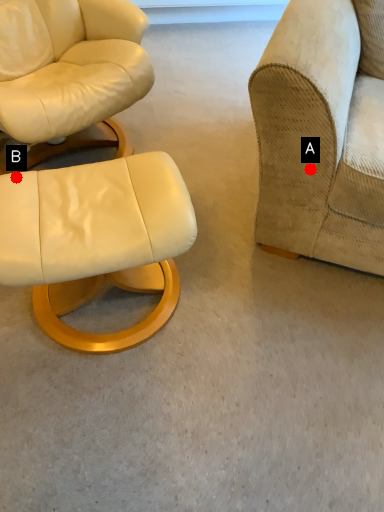
Question: Two points are circled on the image, labeled by A and B beside each circle. Which of the following is the closest to the observer?

Choices:
 (A) A is closer
 (B) B is closer

Answer: (B)